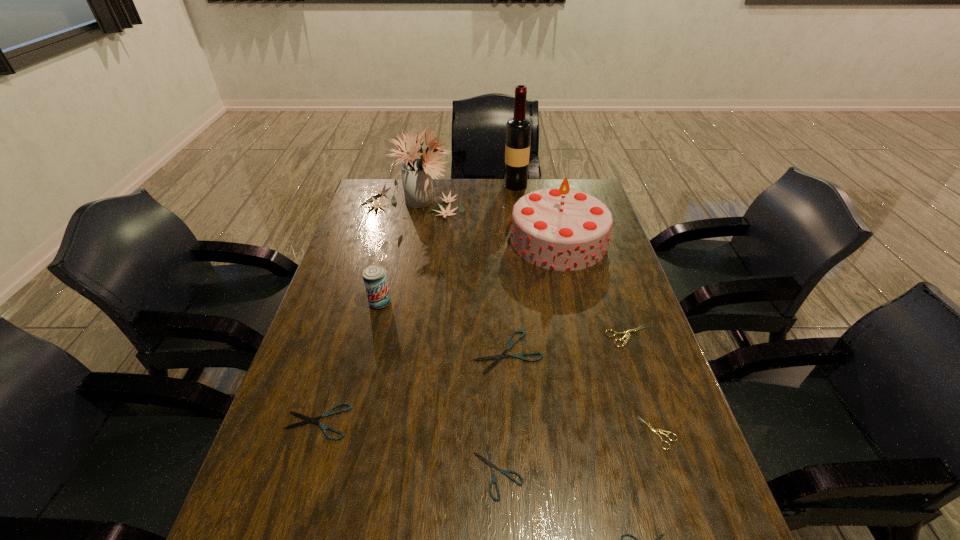
Choose which shears is the third nearest neighbor to the wine bottle. Please provide its 2D coordinates. Your answer should be formatted as a tuple, i.e. [(x, y)], where the tuple contains the x and y coordinates of a point satisfying the conditions above.

[(655, 431)]

Identify which shears is located as the third nearest to the second farthest black shears. Please provide its 2D coordinates. Your answer should be formatted as a tuple, i.e. [(x, y)], where the tuple contains the x and y coordinates of a point satisfying the conditions above.

[(658, 538)]

Select which black shears appears as the second closest to the nearest object. Please provide its 2D coordinates. Your answer should be formatted as a tuple, i.e. [(x, y)], where the tuple contains the x and y coordinates of a point satisfying the conditions above.

[(510, 344)]

In order to click on the second closest black shears to the farther beige shears in this screenshot , I will do `click(491, 463)`.